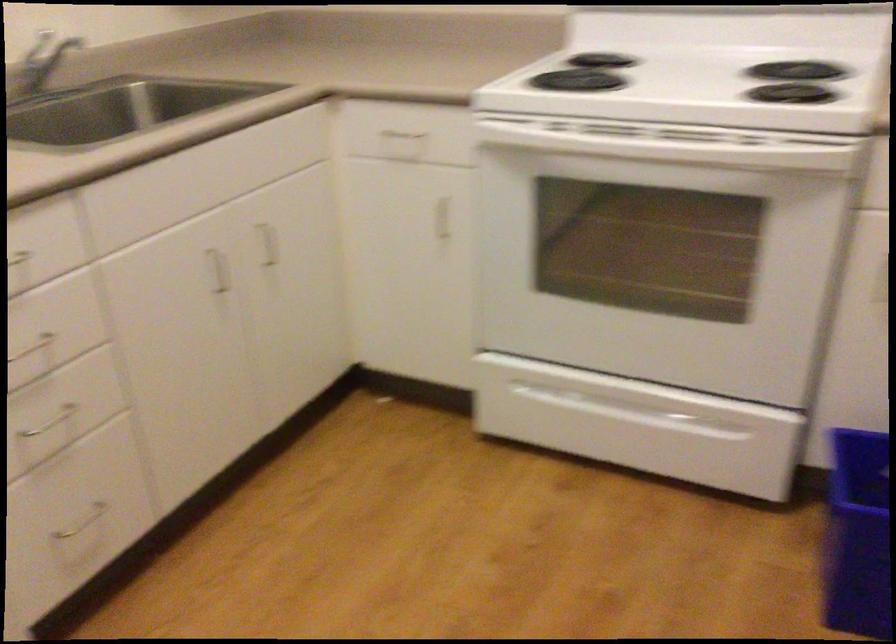
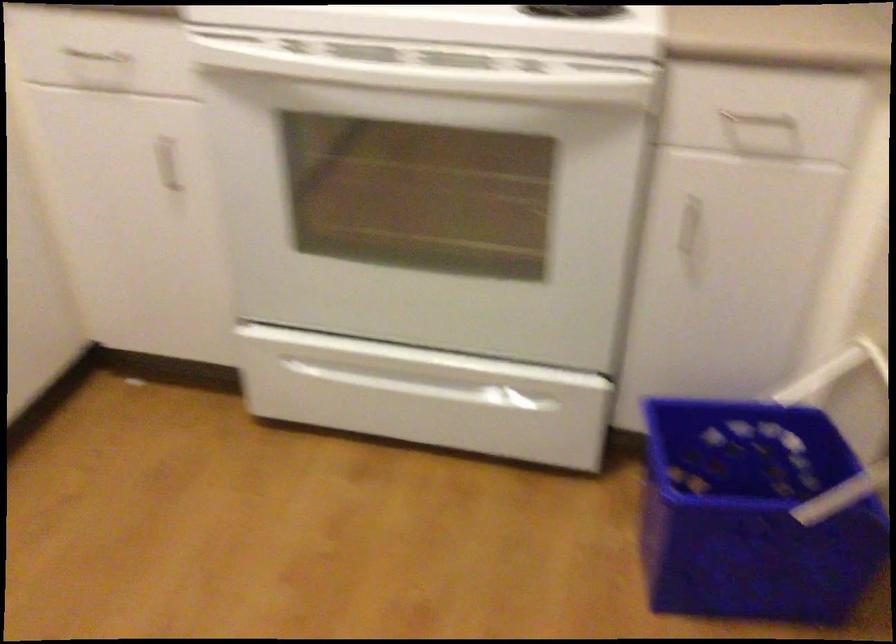
In the second image, find the point that corresponds to the point at 643,406 in the first image.

(435, 379)